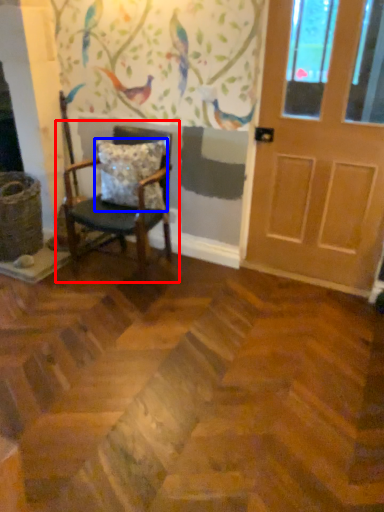
Question: Among these objects, which one is nearest to the camera, chair (highlighted by a red box) or pillow (highlighted by a blue box)?

Choices:
 (A) chair
 (B) pillow

Answer: (A)